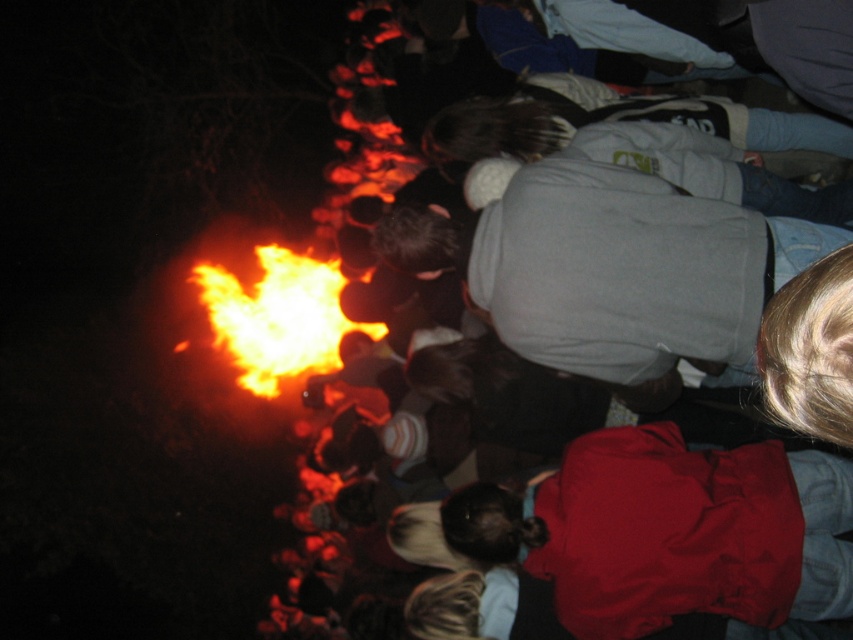
Is point (701, 499) closer to camera compared to point (317, 316)?

Yes.

Between matte red jacket at lower right and flamematerial/texture at center, which one appears on the left side from the viewer's perspective?

From the viewer's perspective, flamematerial/texture at center appears more on the left side.

You are a GUI agent. You are given a task and a screenshot of the screen. Output one action in this format:
    pyautogui.click(x=<x>, y=<y>)
    Task: Click on the matte red jacket at lower right
    This screenshot has width=853, height=640.
    Given the screenshot: What is the action you would take?
    pyautogui.click(x=671, y=531)

Does matte red jacket at lower right have a smaller size compared to matte gray sweater at center?

Correct, matte red jacket at lower right occupies less space than matte gray sweater at center.

The height and width of the screenshot is (640, 853). Describe the element at coordinates (671, 531) in the screenshot. I see `matte red jacket at lower right` at that location.

The width and height of the screenshot is (853, 640). Describe the element at coordinates (671, 531) in the screenshot. I see `matte red jacket at lower right` at that location.

You are a GUI agent. You are given a task and a screenshot of the screen. Output one action in this format:
    pyautogui.click(x=<x>, y=<y>)
    Task: Click on the matte red jacket at lower right
    The width and height of the screenshot is (853, 640).
    Given the screenshot: What is the action you would take?
    pyautogui.click(x=671, y=531)

Consider the image. Is matte gray sweater at center taller than flamematerial/texture at center?

Indeed, matte gray sweater at center has a greater height compared to flamematerial/texture at center.

Can you confirm if matte gray sweater at center is positioned to the right of flamematerial/texture at center?

Yes, matte gray sweater at center is to the right of flamematerial/texture at center.

Which is behind, point (372, 33) or point (337, 300)?

The point (372, 33) is more distant.

At what (x,y) coordinates should I click in order to perform the action: click on matte gray sweater at center. Please return your answer as a coordinate pair (x, y). The height and width of the screenshot is (640, 853). Looking at the image, I should click on (381, 179).